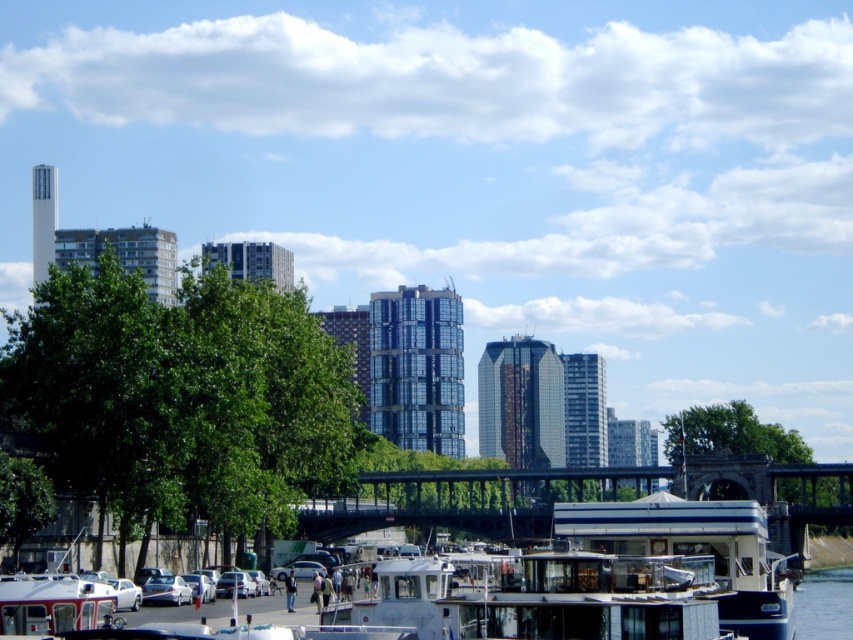
Question: Is transparent glass cabin at lower center closer to the viewer compared to metallic white boat at lower left?

Choices:
 (A) yes
 (B) no

Answer: (A)

Question: Is transparent glass cabin at lower center thinner than green leafy tree at lower left?

Choices:
 (A) no
 (B) yes

Answer: (A)

Question: Based on their relative distances, which object is nearer to the metallic white boat at lower left?

Choices:
 (A) green leafy tree at center
 (B) green leafy tree at left
 (C) transparent glass cabin at lower center

Answer: (C)

Question: Which of the following is the farthest from the observer?

Choices:
 (A) green leafy tree at lower left
 (B) transparent glass cabin at lower center
 (C) white glossy houseboat at lower center
 (D) green leafy tree at center

Answer: (D)

Question: Which object is closer to the camera taking this photo?

Choices:
 (A) green leafy tree at center
 (B) green leafy tree at lower left
 (C) white glossy houseboat at lower center

Answer: (C)

Question: In this image, where is white glossy houseboat at lower center located relative to green leafy tree at lower left?

Choices:
 (A) above
 (B) below

Answer: (B)